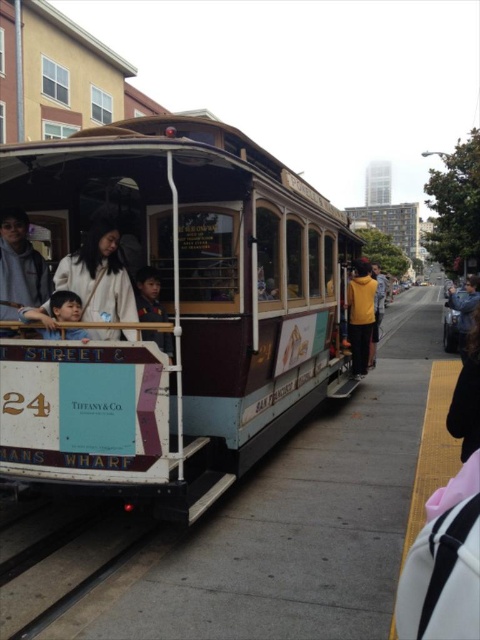
You are a tourist standing on the sidewalk next to the wooden polished cable car at center. You notice a yellow matte jacket at center. Where is the jacket in relation to the cable car?

The yellow matte jacket at center is above the wooden polished cable car at center because the wooden polished cable car at center is below the yellow matte jacket at center.

Looking at this image, you are a tourist standing on the sidewalk next to the wooden polished cable car at center and the matte black shirt at center. You want to take a photo of the cable car without any people blocking the view. Which object should you move out of the way?

The wooden polished cable car at center is positioned under the matte black shirt at center. To take a photo of the cable car without any people blocking the view, you need to move the matte black shirt at center out of the way because it is above the cable car and could be obscuring the view.

You are a tourist standing on the sidewalk next to the wooden polished cable car at center and the matte black shirt at center. You want to take a photo of both objects in the same frame. Which object should you focus on first to ensure both are in the frame?

The wooden polished cable car at center is taller than the matte black shirt at center, so you should focus on the wooden polished cable car at center first to ensure both are in the frame.